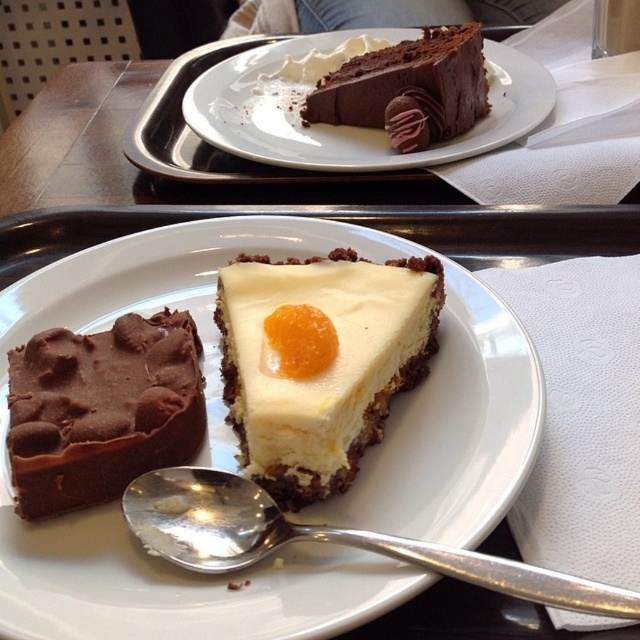
Question: Is white glossy plate at center smaller than chocolate cake at upper center?

Choices:
 (A) no
 (B) yes

Answer: (B)

Question: Is chocolate cake at upper center to the left of smooth chocolate cake at upper center from the viewer's perspective?

Choices:
 (A) yes
 (B) no

Answer: (A)

Question: Which is farther from the white glossy plate at center?

Choices:
 (A) chocolate cake at upper center
 (B) white creamy cake at center

Answer: (A)

Question: Considering the real-world distances, which object is closest to the white glossy plate at center?

Choices:
 (A) smooth chocolate cake at lower left
 (B) chocolate cake at upper center
 (C) silver metallic spoon at lower left

Answer: (A)

Question: Estimate the real-world distances between objects in this image. Which object is closer to the silver metallic spoon at lower left?

Choices:
 (A) chocolate cake at upper center
 (B) white glossy plate at center
 (C) white creamy cake at center
 (D) smooth chocolate cake at upper center

Answer: (B)

Question: Can you confirm if chocolate cake at upper center is smaller than silver metallic spoon at lower left?

Choices:
 (A) yes
 (B) no

Answer: (B)